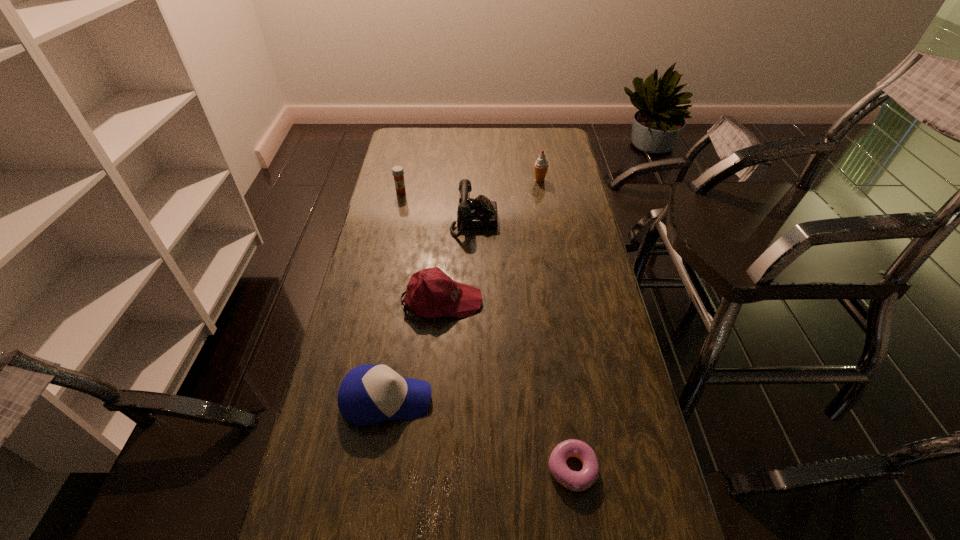
The image size is (960, 540). Find the location of `vacant area between the telephone and the farthest object`. vacant area between the telephone and the farthest object is located at coordinates (507, 201).

Where is `empty space between the nearest object and the farther baseball cap`? empty space between the nearest object and the farther baseball cap is located at coordinates (507, 384).

Locate an element on the screen. The height and width of the screenshot is (540, 960). empty space between the doughnut and the nearer baseball cap is located at coordinates (479, 434).

Find the location of a particular element. vacant space in between the fourth farthest object and the medicine is located at coordinates (421, 246).

Image resolution: width=960 pixels, height=540 pixels. Identify the location of vacant space that is in between the fifth nearest object and the second nearest object. tap(394, 296).

Where is `free area in between the doughnut and the farthest object`? free area in between the doughnut and the farthest object is located at coordinates (556, 325).

Find the location of a particular element. This screenshot has height=540, width=960. object that stands as the fifth closest to the second nearest object is located at coordinates (541, 165).

Identify which object is located as the fifth nearest to the fifth farthest object. Please provide its 2D coordinates. Your answer should be formatted as a tuple, i.e. [(x, y)], where the tuple contains the x and y coordinates of a point satisfying the conditions above.

[(541, 165)]

Where is `free space that satisfies the following two spatial constraints: 1. on the dial of the telephone; 2. on the left side of the shortest object`? The height and width of the screenshot is (540, 960). free space that satisfies the following two spatial constraints: 1. on the dial of the telephone; 2. on the left side of the shortest object is located at coordinates (470, 469).

What are the coordinates of `free location that satisfies the following two spatial constraints: 1. at the front of the farther baseball cap with the brim; 2. on the right side of the doughnut` in the screenshot? It's located at (428, 469).